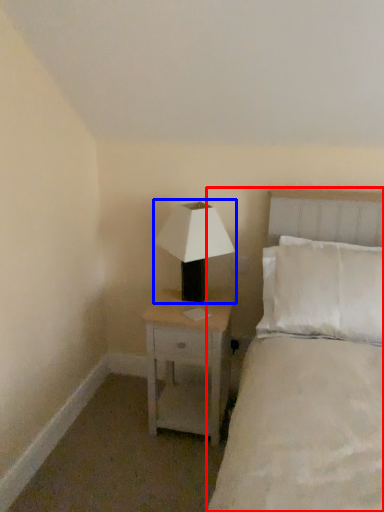
Question: Which point is further to the camera, bed (highlighted by a red box) or lamp (highlighted by a blue box)?

Choices:
 (A) bed
 (B) lamp

Answer: (B)